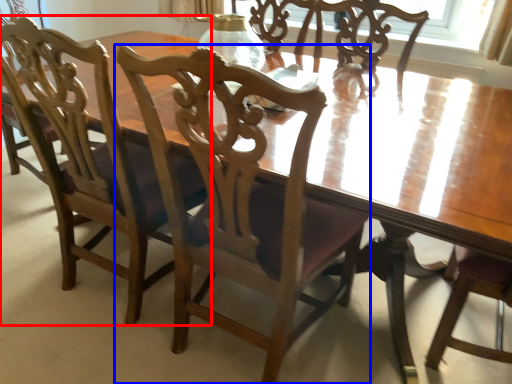
Question: Which object appears farthest to the camera in this image, chair (highlighted by a red box) or chair (highlighted by a blue box)?

Choices:
 (A) chair
 (B) chair

Answer: (A)